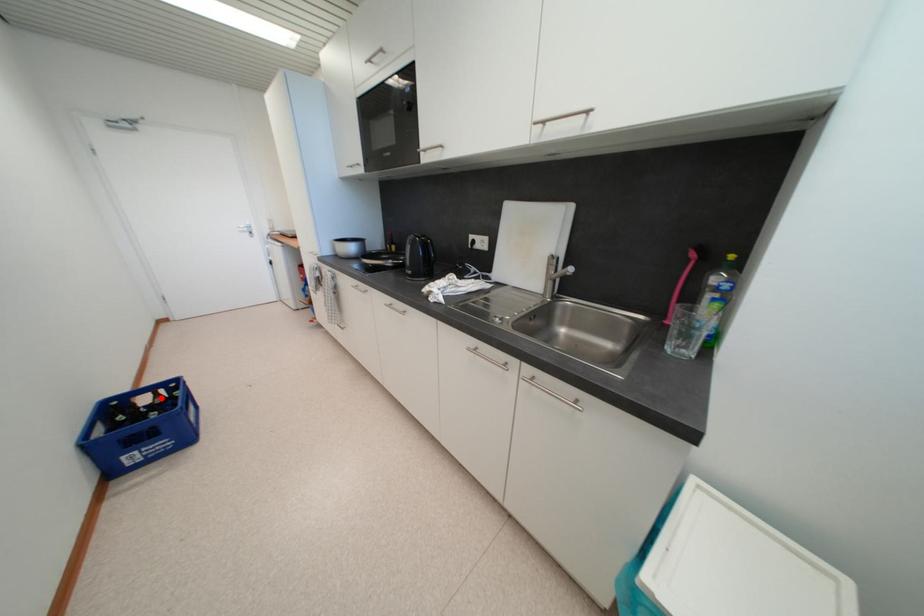
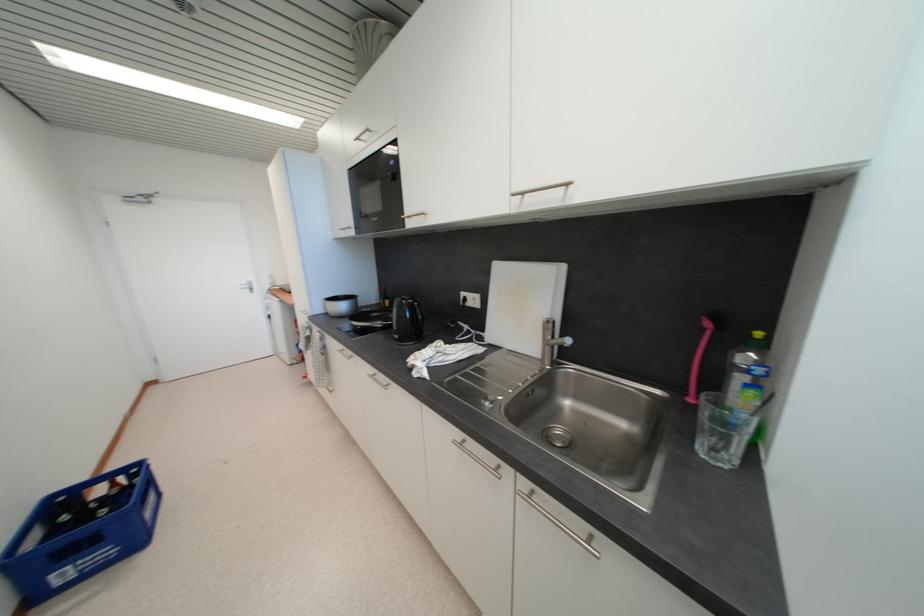
Question: A red point is marked in image1. In image2, is the corresponding 3D point closer to the camera or farther? Reply with the corresponding letter.

Choices:
 (A) The corresponding 3D point is closer.
 (B) The corresponding 3D point is farther.

Answer: (A)